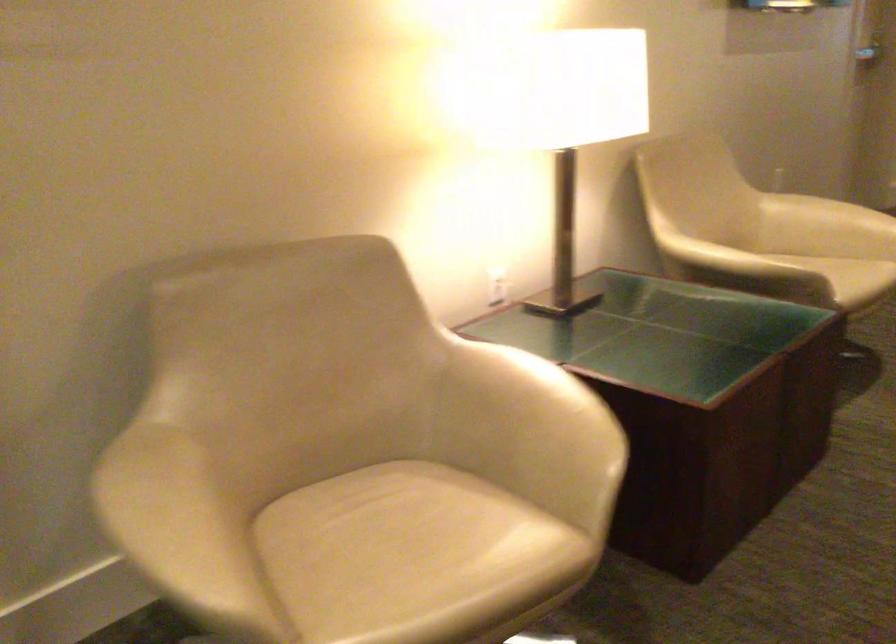
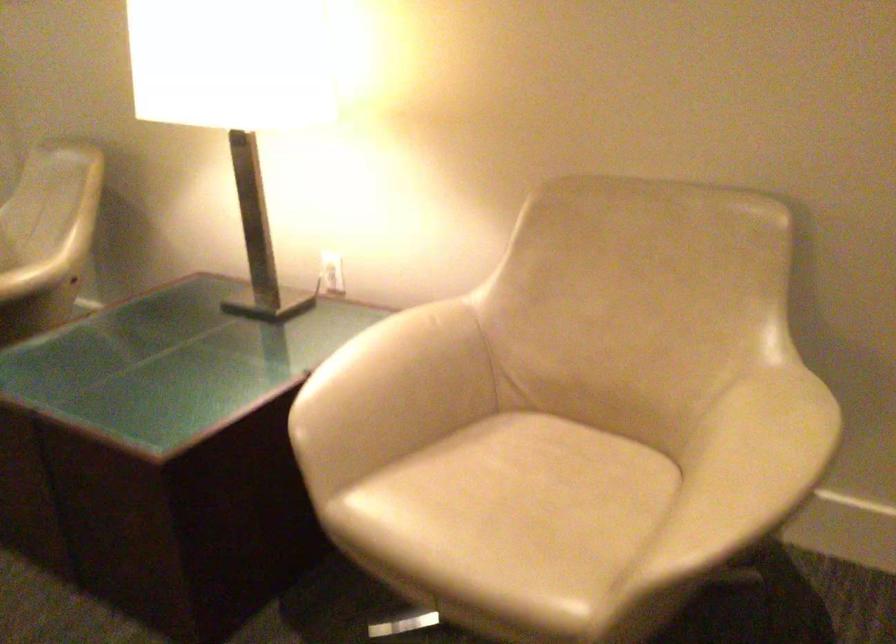
Locate, in the second image, the point that corresponds to [510,274] in the first image.

(332, 272)